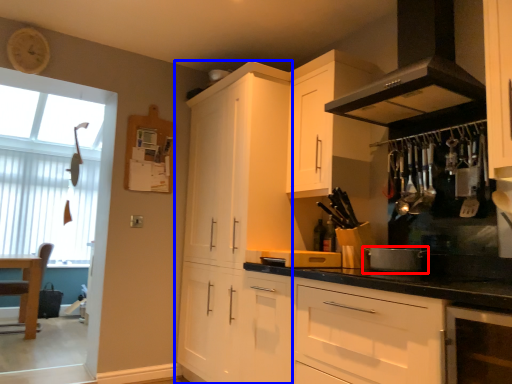
Question: Which object appears closest to the camera in this image, appliance (highlighted by a red box) or cabinetry (highlighted by a blue box)?

Choices:
 (A) appliance
 (B) cabinetry

Answer: (A)